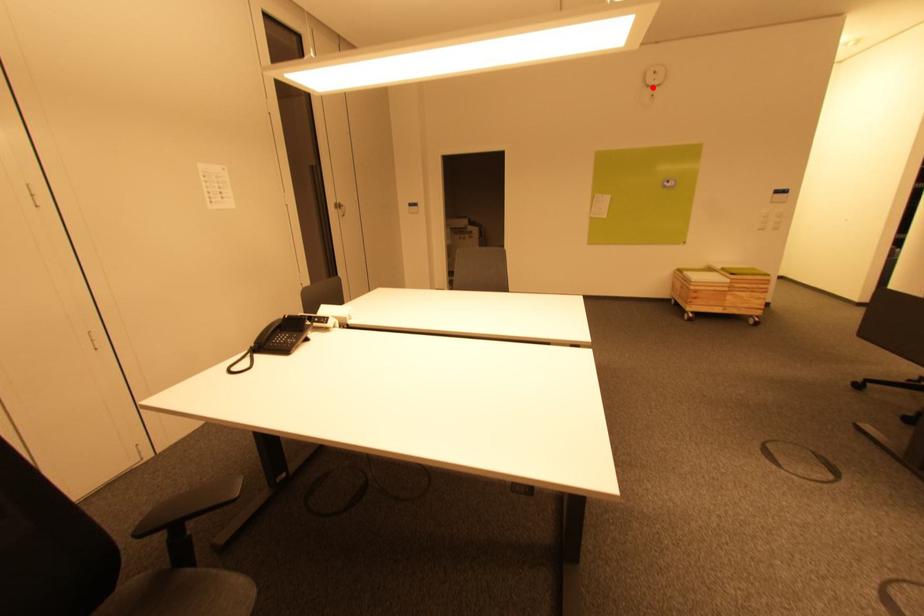
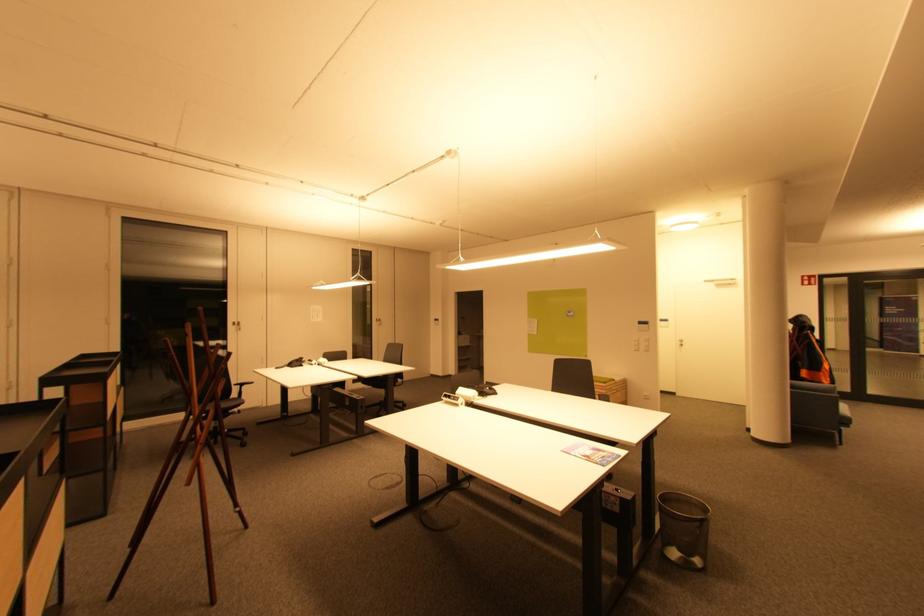
Question: I am providing you with two images of the same scene from different viewpoints. A red point is marked on the first image. Is the red point's position out of view in image 2?

Choices:
 (A) Yes
 (B) No

Answer: (A)